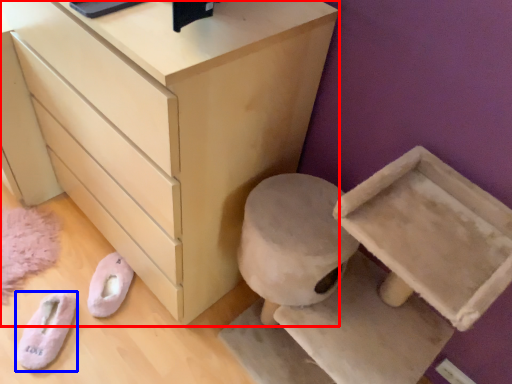
Question: Which of the following is the closest to the observer, chest of drawers (highlighted by a red box) or footwear (highlighted by a blue box)?

Choices:
 (A) chest of drawers
 (B) footwear

Answer: (A)